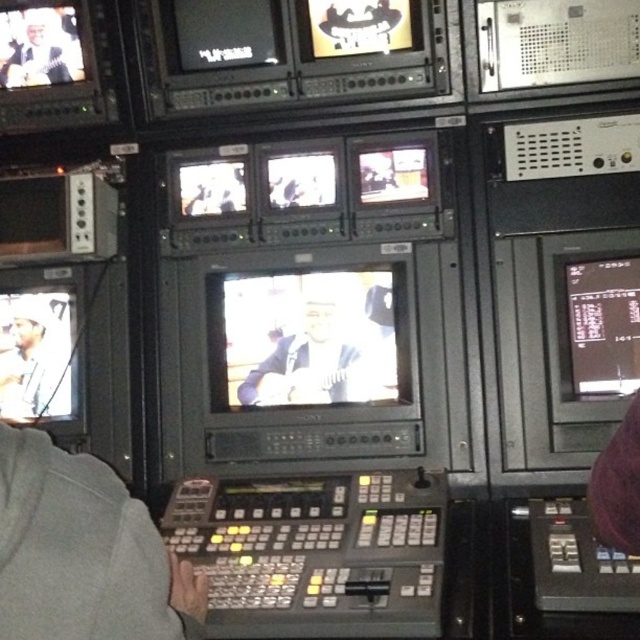
You are a technician in the control room and need to locate the black glossy monitor at right. Based on the coordinate system where the bottom left corner is the origin, can you determine if the point at (604, 324) is on the monitor?

The point at (604, 324) corresponds to the black glossy monitor at right, so yes, the point is on the monitor.

You are an audio technician in the control room. You need to adjust the settings for both the matte black guitar at center and the matte black guitar at left. Which guitar is located in a lower position relative to the other?

The matte black guitar at center is positioned under the matte black guitar at left, so it is located in a lower position.

You are a technician in a control room needing to reach both the black glossy monitor at right and the matte black guitar at left. Your tool requires a minimum of 1 meter of space to operate. Can you comfortably work on both objects without moving them?

The distance between the black glossy monitor at right and the matte black guitar at left is 1.13 meters, which exceeds the 1 meter requirement. Therefore, you can comfortably work on both objects without needing to move them.